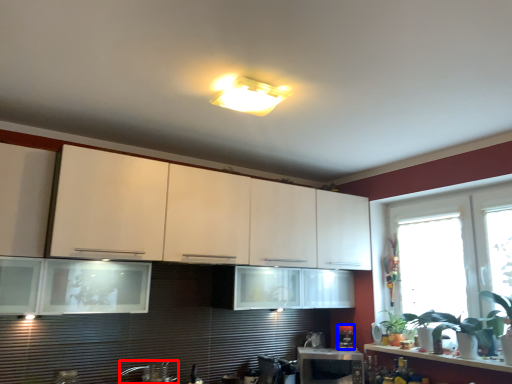
Question: Which point is closer to the camera, faucet (highlighted by a red box) or appliance (highlighted by a blue box)?

Choices:
 (A) faucet
 (B) appliance

Answer: (A)